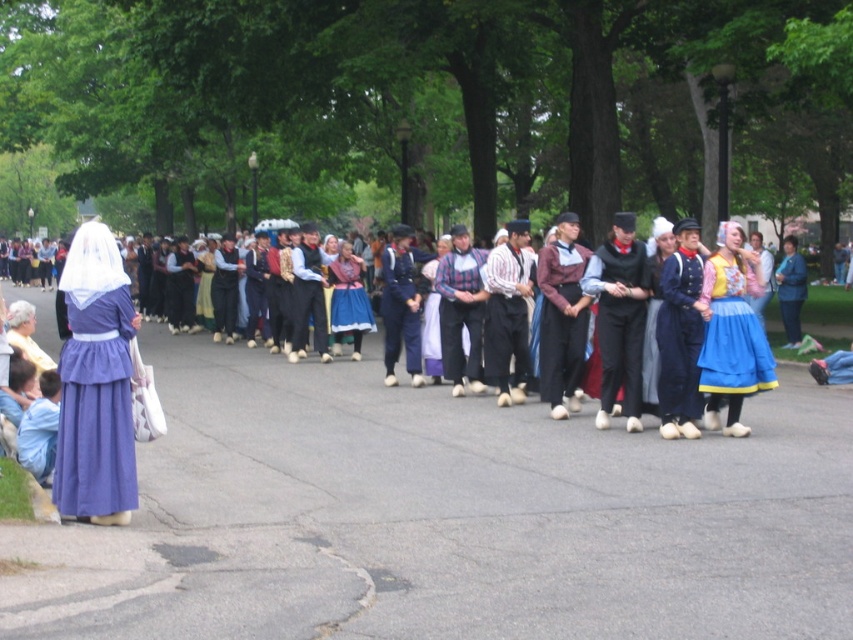
You are a photographer at the event and want to capture a photo where both the blue denim pants at center and the matte black suit at center are visible. Based on their heights, which one might you need to adjust your camera angle to ensure it is fully in the frame?

The blue denim pants at center is not as tall as matte black suit at center, so you might need to lower your camera angle slightly to ensure the taller matte black suit at center is fully captured in the frame.